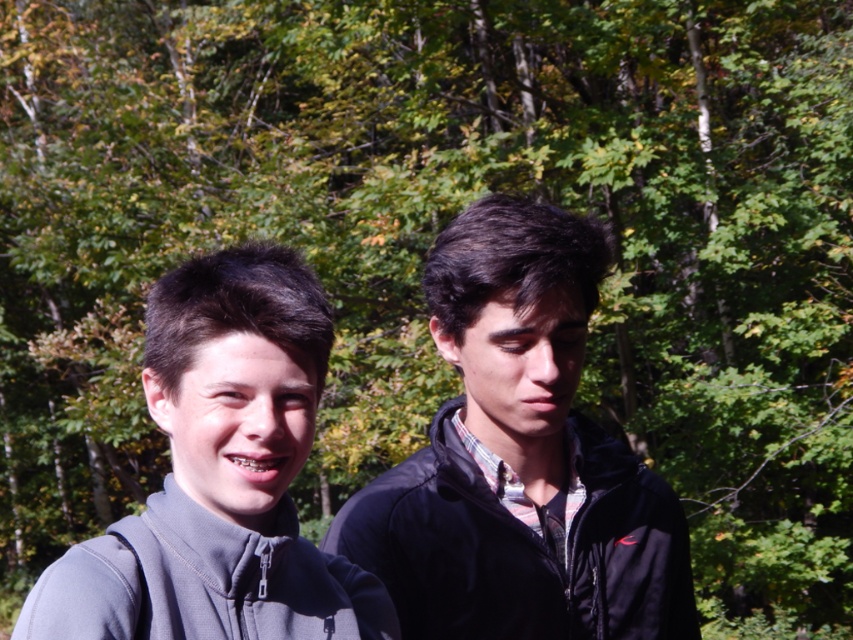
Based on the photo, you are a photographer setting up a shoot in the forest. You need to position a tripod between the gray matte jacket at left and the gray fleece sweatshirt at lower left so that it doesn t block either item. Given their heights, where should you place the tripod?

The gray matte jacket at left is taller than the gray fleece sweatshirt at lower left. To avoid blocking either item, position the tripod between them at a height lower than the gray matte jacket at left but higher than the gray fleece sweatshirt at lower left.

You are a photographer trying to capture a portrait of both people in the image. The camera you are using has a lens with a maximum aperture of f1.4. Considering the distance between the black matte jacket at center and gray matte jacket at left, will you need to adjust your focus to ensure both are in sharp focus?

The black matte jacket at center and gray matte jacket at left are 27.24 inches apart. With a lens aperture of f1.4, the depth of field is relatively shallow. To ensure both are in focus, you may need to adjust your focus to a point between them or use a smaller aperture if possible.